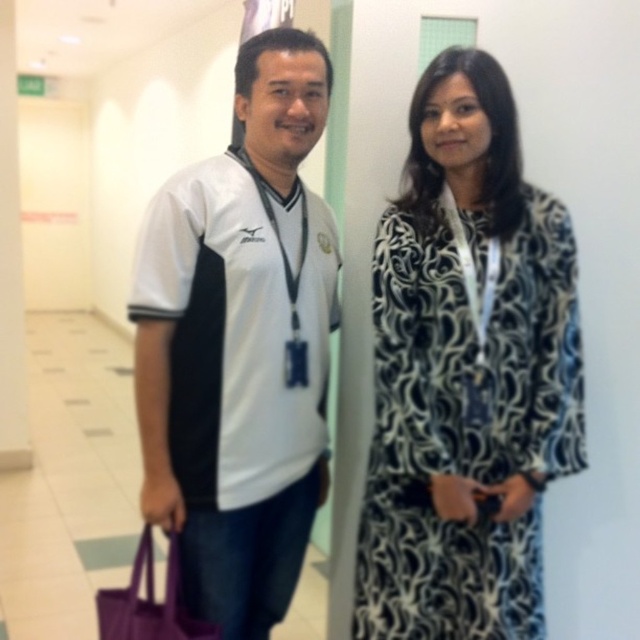
Does white jersey at center appear on the right side of black and white patterned dress at right?

No, white jersey at center is not to the right of black and white patterned dress at right.

Who is taller, white jersey at center or black and white patterned dress at right?

With more height is white jersey at center.

Locate an element on the screen. white jersey at center is located at coordinates (241, 346).

Is white jersey at left to the right of white jersey at center from the viewer's perspective?

Indeed, white jersey at left is positioned on the right side of white jersey at center.

Is point (385, 419) more distant than point (243, 141)?

No, it is not.

Between point (420, 154) and point (253, 356), which one is positioned behind?

Point (420, 154)

You are a GUI agent. You are given a task and a screenshot of the screen. Output one action in this format:
    pyautogui.click(x=<x>, y=<y>)
    Task: Click on the white jersey at left
    This screenshot has height=640, width=640.
    Given the screenshot: What is the action you would take?
    pyautogui.click(x=467, y=374)

Consider the image. Is white jersey at left shorter than purple fabric bag at lower left?

Incorrect, white jersey at left's height does not fall short of purple fabric bag at lower left's.

Which of these two, white jersey at left or purple fabric bag at lower left, stands shorter?

purple fabric bag at lower left

Is point (480, 476) closer to viewer compared to point (96, 595)?

Yes.

Find the location of a particular element. Image resolution: width=640 pixels, height=640 pixels. white jersey at left is located at coordinates (467, 374).